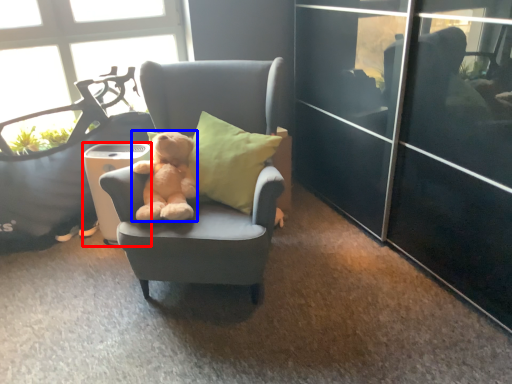
Question: Which point is closer to the camera, trash bin/can (highlighted by a red box) or teddy bear (highlighted by a blue box)?

Choices:
 (A) trash bin/can
 (B) teddy bear

Answer: (B)